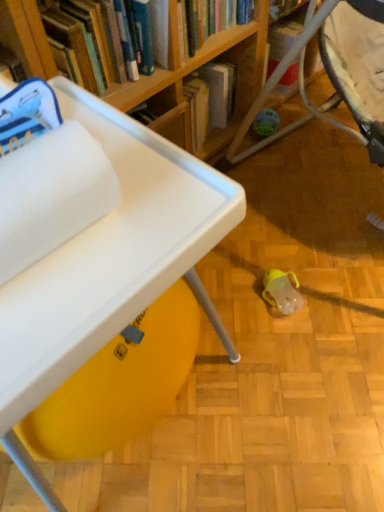
Question: Does white fluffy towel at upper left contain wooden bookshelf at upper center?

Choices:
 (A) yes
 (B) no

Answer: (B)

Question: Does white fluffy towel at upper left have a lesser width compared to wooden bookshelf at upper center?

Choices:
 (A) yes
 (B) no

Answer: (A)

Question: Would you say white fluffy towel at upper left is a long distance from wooden bookshelf at upper center?

Choices:
 (A) yes
 (B) no

Answer: (B)

Question: From a real-world perspective, is white fluffy towel at upper left below wooden bookshelf at upper center?

Choices:
 (A) yes
 (B) no

Answer: (B)

Question: Does white fluffy towel at upper left have a greater height compared to wooden bookshelf at upper center?

Choices:
 (A) no
 (B) yes

Answer: (A)

Question: Is white fluffy towel at upper left at the right side of wooden bookshelf at upper center?

Choices:
 (A) no
 (B) yes

Answer: (B)

Question: From the image's perspective, would you say white plastic table at lower left is shown under white fluffy towel at upper left?

Choices:
 (A) no
 (B) yes

Answer: (B)

Question: Is white plastic table at lower left wider than white fluffy towel at upper left?

Choices:
 (A) no
 (B) yes

Answer: (B)

Question: Could you tell me if white plastic table at lower left is turned towards white fluffy towel at upper left?

Choices:
 (A) yes
 (B) no

Answer: (B)

Question: Is white plastic table at lower left with white fluffy towel at upper left?

Choices:
 (A) no
 (B) yes

Answer: (B)

Question: Are white plastic table at lower left and white fluffy towel at upper left far apart?

Choices:
 (A) no
 (B) yes

Answer: (A)

Question: Is white plastic table at lower left further to camera compared to white fluffy towel at upper left?

Choices:
 (A) yes
 (B) no

Answer: (A)

Question: Is wooden bookshelf at upper center facing away from white fluffy towel at upper left?

Choices:
 (A) yes
 (B) no

Answer: (B)